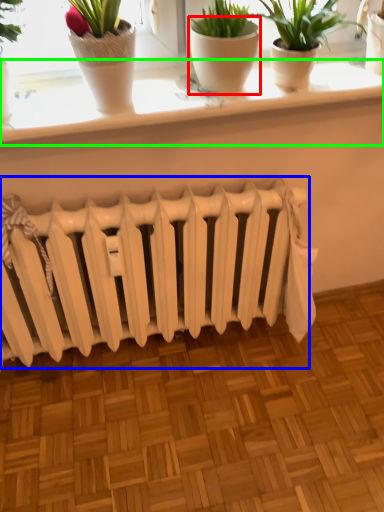
Question: Which object is positioned farthest from flowerpot (highlighted by a red box)? Select from radiator (highlighted by a blue box) and window sill (highlighted by a green box).

Choices:
 (A) radiator
 (B) window sill

Answer: (A)